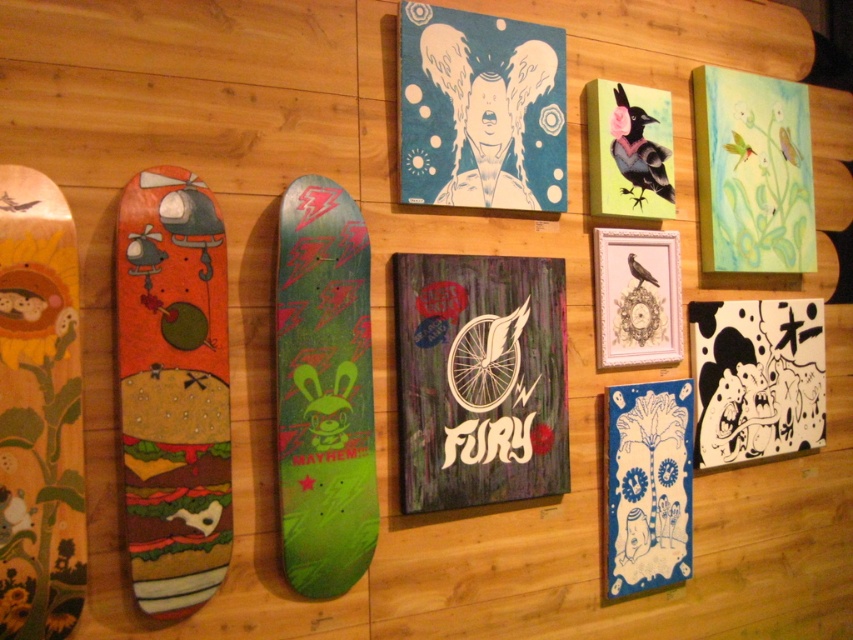
Is black/white/abstract art at lower right to the right of matte black bird at upper right from the viewer's perspective?

Indeed, black/white/abstract art at lower right is positioned on the right side of matte black bird at upper right.

Does black/white/abstract art at lower right have a larger size compared to matte black bird at upper right?

Yes, black/white/abstract art at lower right is bigger than matte black bird at upper right.

Who is more forward, (801, 317) or (598, 189)?

Point (598, 189)

The height and width of the screenshot is (640, 853). What are the coordinates of `black/white/abstract art at lower right` in the screenshot? It's located at (757, 378).

Can you confirm if blue painted canvas at upper center is wider than matte black bird at upper right?

Correct, the width of blue painted canvas at upper center exceeds that of matte black bird at upper right.

Can you confirm if blue painted canvas at upper center is thinner than matte black bird at upper right?

No, blue painted canvas at upper center is not thinner than matte black bird at upper right.

The height and width of the screenshot is (640, 853). What are the coordinates of `blue painted canvas at upper center` in the screenshot? It's located at [x=480, y=109].

Who is more forward, (671, 314) or (595, 84)?

Point (595, 84)

Is point (663, 333) farther from viewer compared to point (595, 184)?

Yes, it is behind point (595, 184).

Locate an element on the screen. wooden clock with bird at center is located at coordinates (636, 296).

Locate an element on the screen. wooden clock with bird at center is located at coordinates (636, 296).